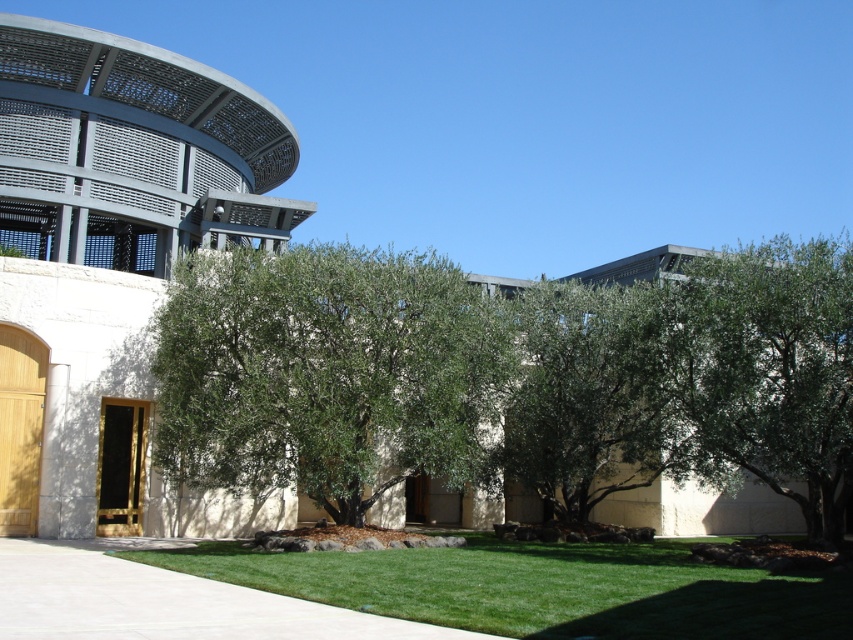
Question: Estimate the real-world distances between objects in this image. Which object is farther from the green lawn at center?

Choices:
 (A) green leafy tree at center
 (B) green leafy tree at right

Answer: (B)

Question: Among these points, which one is nearest to the camera?

Choices:
 (A) (473, 577)
 (B) (728, 253)
 (C) (604, 296)
 (D) (364, 284)

Answer: (A)

Question: Can you confirm if green leafy olive tree at center is thinner than green leafy tree at center?

Choices:
 (A) no
 (B) yes

Answer: (A)

Question: Does green leafy tree at right have a greater width compared to green leafy tree at center?

Choices:
 (A) yes
 (B) no

Answer: (A)

Question: Is green leafy olive tree at center below green leafy tree at right?

Choices:
 (A) no
 (B) yes

Answer: (B)

Question: Considering the real-world distances, which object is farthest from the green leafy olive tree at center?

Choices:
 (A) green lawn at center
 (B) green leafy tree at right
 (C) green leafy tree at center

Answer: (B)